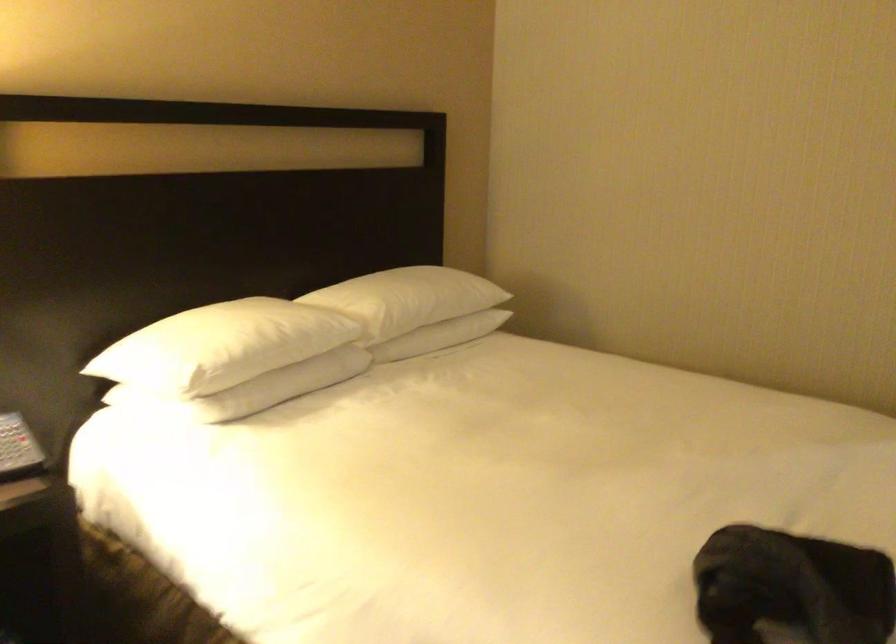
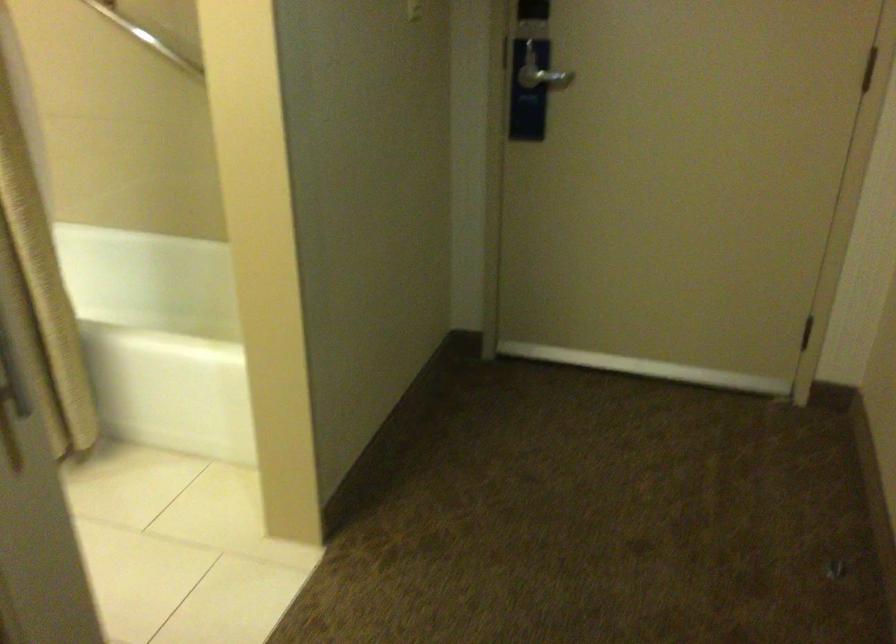
In the scene shown: What movement of the cameraman would produce the second image?

The cameraman moved toward right, forward.